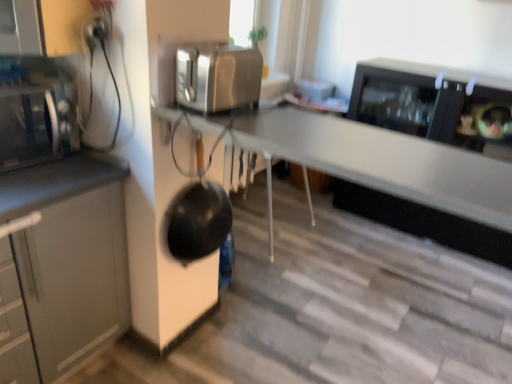
Question: In terms of height, does satin silver toaster at upper center look taller or shorter compared to matte black microwave at left?

Choices:
 (A) short
 (B) tall

Answer: (A)

Question: Choose the correct answer: Is satin silver toaster at upper center inside matte black microwave at left or outside it?

Choices:
 (A) inside
 (B) outside

Answer: (B)

Question: Based on their relative distances, which object is nearer to the satin silver toaster at upper center?

Choices:
 (A) matte black microwave at left
 (B) black matte wok at center

Answer: (B)

Question: Estimate the real-world distances between objects in this image. Which object is farther from the matte black microwave at left?

Choices:
 (A) black matte wok at center
 (B) satin silver toaster at upper center

Answer: (B)